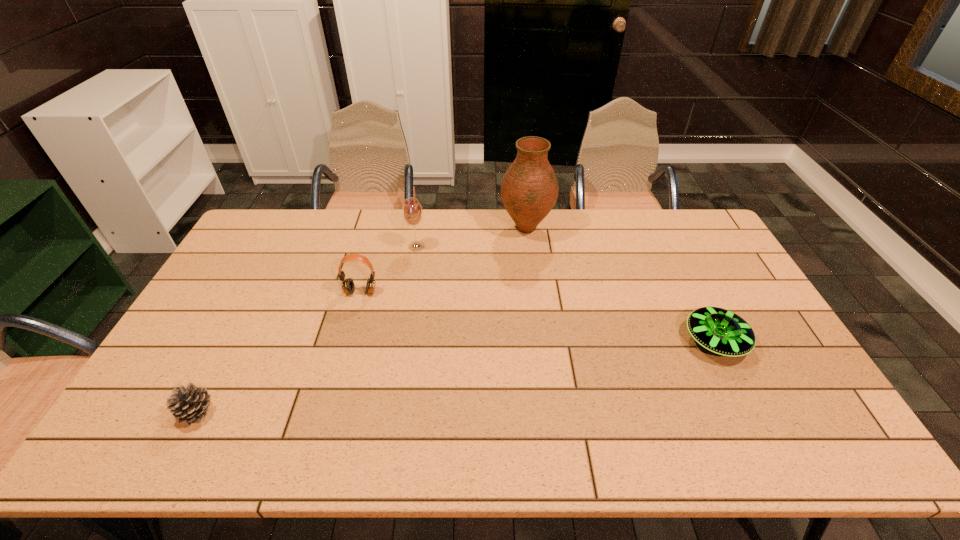
Where is `vacant area situated 0.060m on the right of the vase`? This screenshot has width=960, height=540. vacant area situated 0.060m on the right of the vase is located at coordinates (569, 228).

You are a GUI agent. You are given a task and a screenshot of the screen. Output one action in this format:
    pyautogui.click(x=<x>, y=<y>)
    Task: Click on the vacant area situated 0.150m on the back of the second tallest object
    Image resolution: width=960 pixels, height=540 pixels.
    Given the screenshot: What is the action you would take?
    pyautogui.click(x=421, y=216)

Where is `free spot located 0.130m on the ear cups of the third tallest object`? The width and height of the screenshot is (960, 540). free spot located 0.130m on the ear cups of the third tallest object is located at coordinates (350, 329).

Identify the location of blank space located 0.060m on the left of the nearest object. (154, 412).

Where is `free region located on the left of the saucer`? This screenshot has height=540, width=960. free region located on the left of the saucer is located at coordinates (635, 341).

You are a GUI agent. You are given a task and a screenshot of the screen. Output one action in this format:
    pyautogui.click(x=<x>, y=<y>)
    Task: Click on the vase located at the far edge
    The width and height of the screenshot is (960, 540).
    Given the screenshot: What is the action you would take?
    pyautogui.click(x=529, y=190)

The width and height of the screenshot is (960, 540). I want to click on wineglass that is at the far edge, so coord(412,212).

At what (x,y) coordinates should I click in order to perform the action: click on object present at the near edge. Please return your answer as a coordinate pair (x, y). This screenshot has width=960, height=540. Looking at the image, I should click on (190, 404).

Identify the location of object present at the left edge. The width and height of the screenshot is (960, 540). (190, 404).

Locate an element on the screen. The image size is (960, 540). object that is at the right edge is located at coordinates (718, 330).